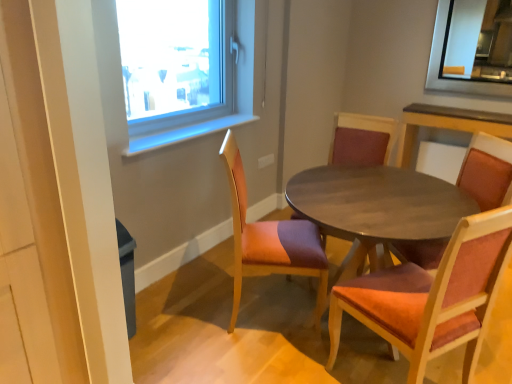
Question: From the image's perspective, relative to wooden chair with red cushion at center, placed as the third chair when sorted from right to left, is wooden textured chair at center, placed as the 4th chair when sorted from right to left, above or below?

Choices:
 (A) above
 (B) below

Answer: (B)

Question: Is point (234, 147) closer or farther from the camera than point (380, 148)?

Choices:
 (A) closer
 (B) farther

Answer: (A)

Question: Which is farther from the velvet orange chair at center, the 3th chair positioned from the left?

Choices:
 (A) wooden textured chair at center, acting as the first chair starting from the left
 (B) wooden textured chair at center, the 4th chair when ordered from left to right
 (C) wooden table at center
 (D) wooden chair with red cushion at center, which appears as the 2th chair when viewed from the left

Answer: (D)

Question: Which of these objects is positioned farthest from the velvet orange chair at center, the 3th chair positioned from the left?

Choices:
 (A) wooden textured chair at center, acting as the first chair starting from the left
 (B) wooden chair with red cushion at center, placed as the third chair when sorted from right to left
 (C) wooden table at center
 (D) wooden textured chair at center, the 4th chair when ordered from left to right

Answer: (B)